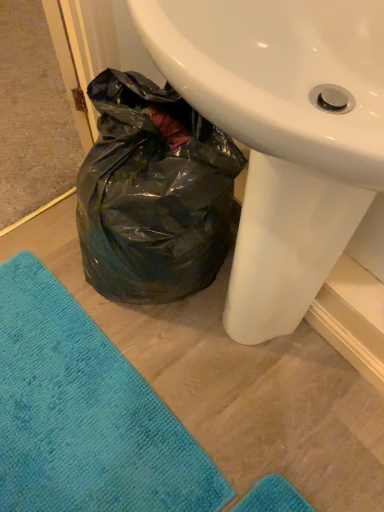
Find the location of a particular element. The image size is (384, 512). vacant space underneath teal soft towel at lower left (from a real-world perspective) is located at coordinates (63, 412).